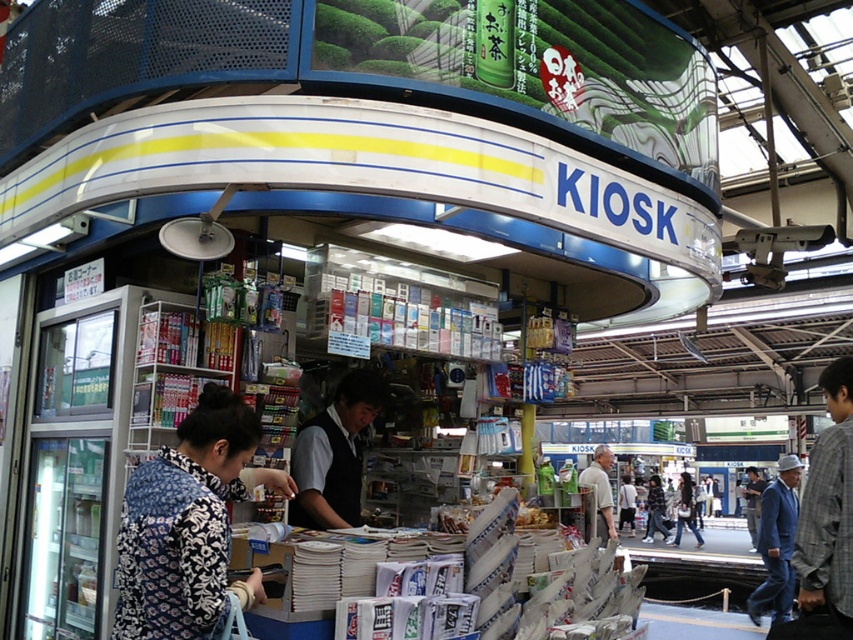
What is the 2D coordinate of the printed fabric blouse at center in the kiosk?

The printed fabric blouse at center is located at the 2D coordinate point of (189, 524).

You are shopping at the kiosk and want to buy both the printed fabric blouse at center and the blue denim jacket at lower right. If you start from the entrance, which item would you encounter first?

The printed fabric blouse at center is to the left of the blue denim jacket at lower right. Since you enter the kiosk facing the interior, items on the left side would be encountered first. Therefore, you would first encounter the printed fabric blouse at center before reaching the blue denim jacket at lower right.